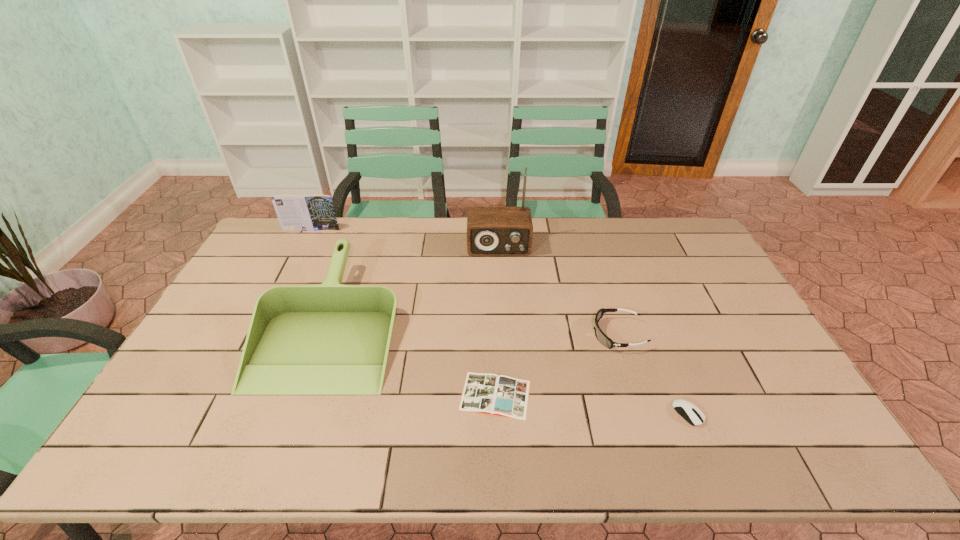
Locate an element on the screen. The width and height of the screenshot is (960, 540). the tallest object is located at coordinates (491, 231).

Locate an element on the screen. The image size is (960, 540). radio receiver is located at coordinates (491, 231).

The height and width of the screenshot is (540, 960). I want to click on the taller book, so point(314,212).

Find the location of a particular element. The image size is (960, 540). the left book is located at coordinates (314, 212).

This screenshot has width=960, height=540. Find the location of `the third tallest object`. the third tallest object is located at coordinates (329, 339).

You are a GUI agent. You are given a task and a screenshot of the screen. Output one action in this format:
    pyautogui.click(x=<x>, y=<y>)
    Task: Click on the second object from right to left
    This screenshot has height=540, width=960.
    Given the screenshot: What is the action you would take?
    pyautogui.click(x=601, y=337)

Locate an element on the screen. Image resolution: width=960 pixels, height=540 pixels. the fourth tallest object is located at coordinates (601, 337).

Find the location of a particular element. This screenshot has width=960, height=540. the second shortest object is located at coordinates (691, 413).

You are a GUI agent. You are given a task and a screenshot of the screen. Output one action in this format:
    pyautogui.click(x=<x>, y=<y>)
    Task: Click on the rightmost object
    
    Given the screenshot: What is the action you would take?
    pyautogui.click(x=691, y=413)

The width and height of the screenshot is (960, 540). In order to click on the nearer book in this screenshot , I will do `click(504, 396)`.